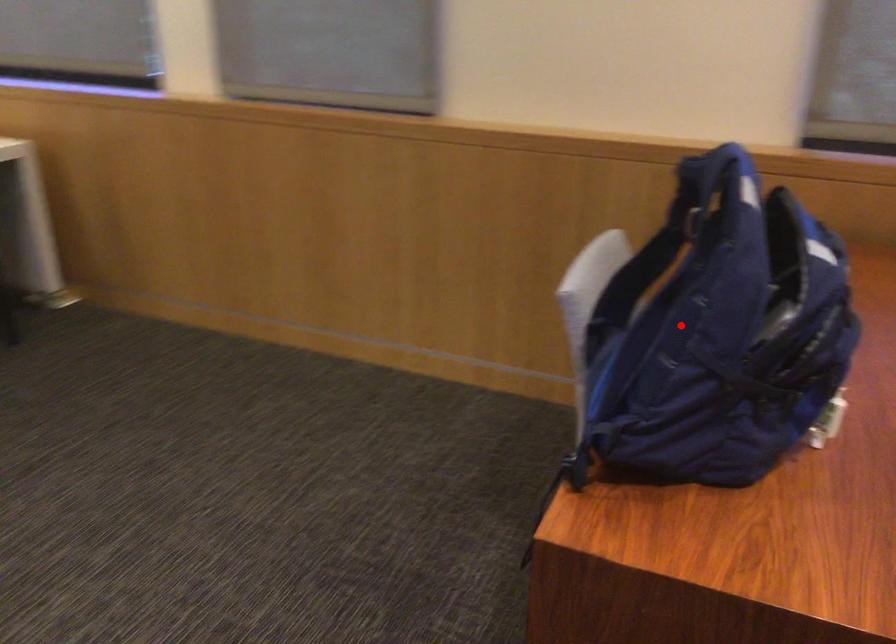
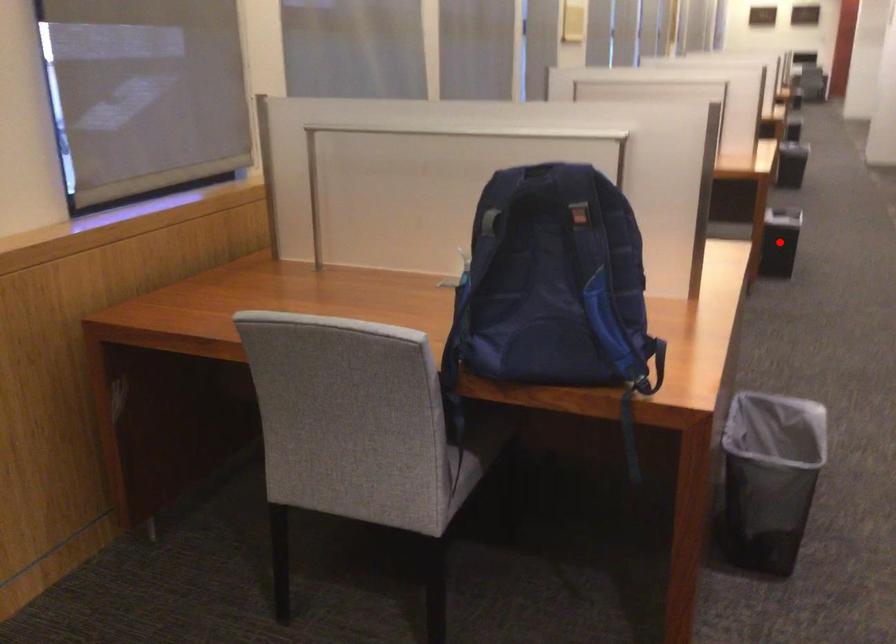
I am providing you with two images of the same scene from different viewpoints. A red point is marked on the first image and another point is marked on the second image. Do the highlighted points in image1 and image2 indicate the same real-world spot?

No